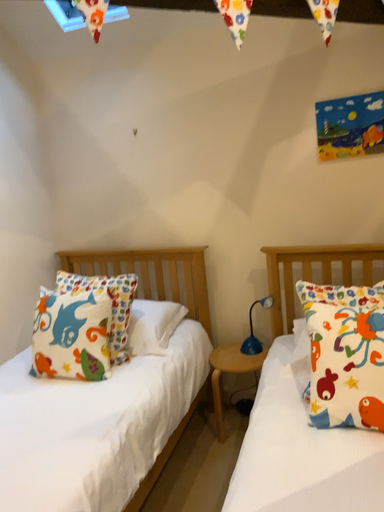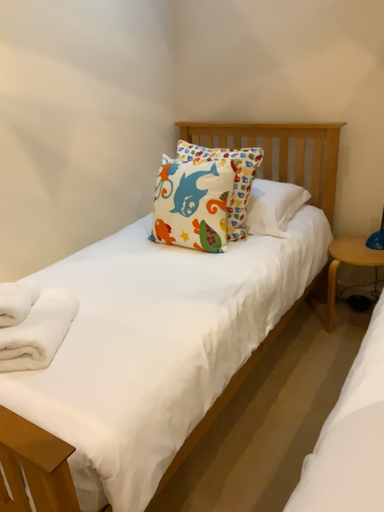
Question: Which way did the camera rotate in the video?

Choices:
 (A) rotated left
 (B) rotated right

Answer: (A)